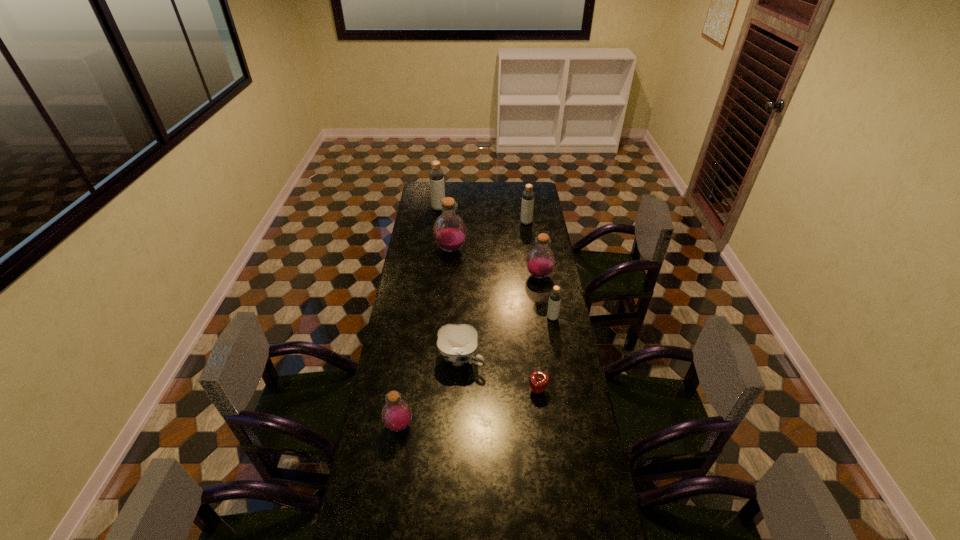
Where is `the smallest purple bottle`? This screenshot has width=960, height=540. the smallest purple bottle is located at coordinates (396, 414).

You are a GUI agent. You are given a task and a screenshot of the screen. Output one action in this format:
    pyautogui.click(x=<x>, y=<y>)
    Task: Click on the nearest bottle
    The height and width of the screenshot is (540, 960).
    Given the screenshot: What is the action you would take?
    pyautogui.click(x=396, y=414)

I want to click on the second shortest object, so (x=457, y=343).

You are a GUI agent. You are given a task and a screenshot of the screen. Output one action in this format:
    pyautogui.click(x=<x>, y=<y>)
    Task: Click on the blue chinaware
    This screenshot has width=960, height=540.
    Given the screenshot: What is the action you would take?
    pyautogui.click(x=457, y=343)

You are a GUI agent. You are given a task and a screenshot of the screen. Output one action in this format:
    pyautogui.click(x=<x>, y=<y>)
    Task: Click on the shortest object
    The width and height of the screenshot is (960, 540).
    Given the screenshot: What is the action you would take?
    pyautogui.click(x=538, y=381)

Where is `apple`? This screenshot has height=540, width=960. apple is located at coordinates (538, 381).

Identify the location of vacant area located 0.400m on the right of the leftmost gray bottle. This screenshot has height=540, width=960. (513, 208).

Where is `vacant space located 0.330m on the back of the farthest purple bottle`? Image resolution: width=960 pixels, height=540 pixels. vacant space located 0.330m on the back of the farthest purple bottle is located at coordinates (454, 207).

Where is `vacant region located on the back of the second smallest gray bottle`? vacant region located on the back of the second smallest gray bottle is located at coordinates (522, 196).

This screenshot has height=540, width=960. What are the coordinates of `vacant position located on the front of the fifth nearest object` in the screenshot? It's located at (542, 298).